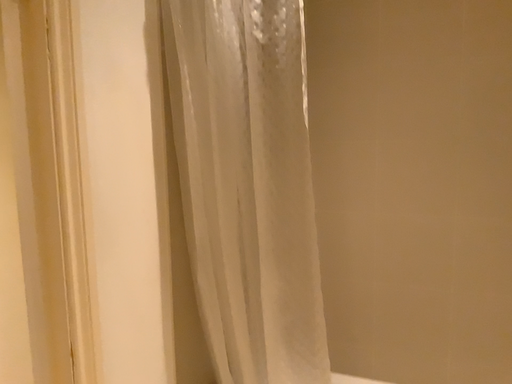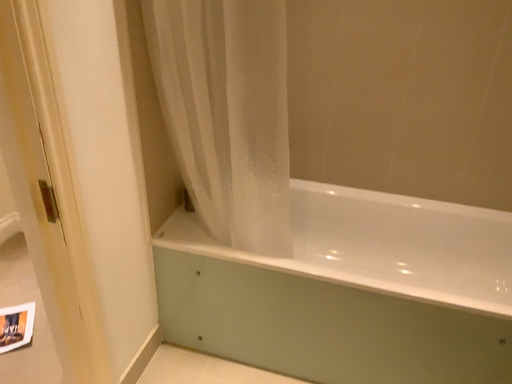
Question: How did the camera likely rotate when shooting the video?

Choices:
 (A) rotated left
 (B) rotated right

Answer: (B)